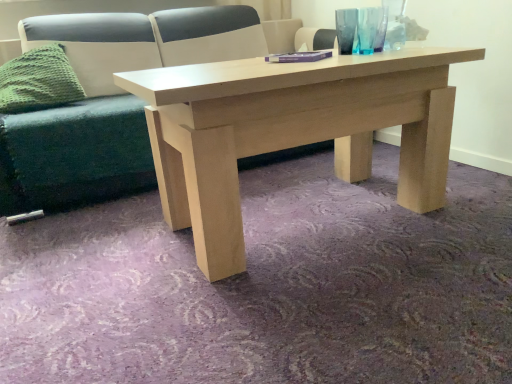
Question: Is green knitted pillow at left not close to transparent glass vase at upper right?

Choices:
 (A) no
 (B) yes

Answer: (B)

Question: Is green knitted pillow at left positioned in front of transparent glass vase at upper right?

Choices:
 (A) no
 (B) yes

Answer: (A)

Question: Can you confirm if green knitted pillow at left is positioned to the right of transparent glass vase at upper right?

Choices:
 (A) no
 (B) yes

Answer: (A)

Question: Does green knitted pillow at left turn towards transparent glass vase at upper right?

Choices:
 (A) yes
 (B) no

Answer: (B)

Question: Can you confirm if green knitted pillow at left is wider than transparent glass vase at upper right?

Choices:
 (A) no
 (B) yes

Answer: (B)

Question: Is transparent glass vase at upper right surrounded by green knitted pillow at left?

Choices:
 (A) yes
 (B) no

Answer: (B)

Question: Can you confirm if transparent glass vase at upper right is bigger than green knitted pillow at left?

Choices:
 (A) yes
 (B) no

Answer: (B)

Question: Is transparent glass vase at upper right positioned behind green knitted pillow at left?

Choices:
 (A) no
 (B) yes

Answer: (A)

Question: Is transparent glass vase at upper right shorter than green knitted pillow at left?

Choices:
 (A) no
 (B) yes

Answer: (B)

Question: Is transparent glass vase at upper right to the left of green knitted pillow at left from the viewer's perspective?

Choices:
 (A) yes
 (B) no

Answer: (B)

Question: Does transparent glass vase at upper right have a smaller size compared to green knitted pillow at left?

Choices:
 (A) no
 (B) yes

Answer: (B)

Question: Is transparent glass vase at upper right wider than green knitted pillow at left?

Choices:
 (A) yes
 (B) no

Answer: (B)

Question: Is green fabric couch at center oriented towards purple matte book at center?

Choices:
 (A) yes
 (B) no

Answer: (A)